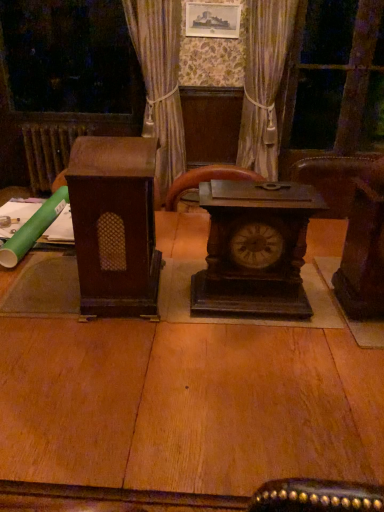
Question: From a real-world perspective, is brown wood speaker at left, which appears as the second furniture when viewed from the right, positioned above or below dark brown wood clock at center?

Choices:
 (A) below
 (B) above

Answer: (B)

Question: Considering the positions of brown wood speaker at left, which appears as the second furniture when viewed from the right, and dark brown wood clock at center in the image, is brown wood speaker at left, which appears as the second furniture when viewed from the right, wider or thinner than dark brown wood clock at center?

Choices:
 (A) thin
 (B) wide

Answer: (B)

Question: Which of these objects is positioned farthest from the transparent glass door at upper right?

Choices:
 (A) dark wood chair at right, the 1th furniture when ordered from right to left
 (B) dark brown wood clock at center
 (C) brown wooden radiator at left
 (D) brown wood speaker at left, which appears as the second furniture when viewed from the right
 (E) silky beige curtain at center

Answer: (D)

Question: Estimate the real-world distances between objects in this image. Which object is closer to the dark brown wood clock at center?

Choices:
 (A) brown wooden radiator at left
 (B) transparent glass door at upper right
 (C) dark wood chair at right, which is counted as the second furniture, starting from the left
 (D) brown wood speaker at left, the 1th furniture viewed from the left
 (E) silky beige curtain at center

Answer: (D)